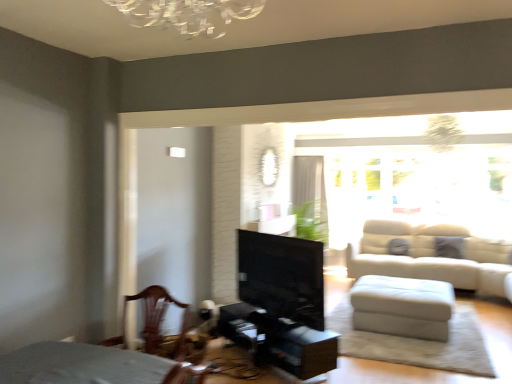
Question: Considering the relative sizes of transparent glass window at upper right and black glossy fireplace at center in the image provided, is transparent glass window at upper right taller than black glossy fireplace at center?

Choices:
 (A) no
 (B) yes

Answer: (B)

Question: Is transparent glass window at upper right not inside black glossy fireplace at center?

Choices:
 (A) yes
 (B) no

Answer: (A)

Question: Considering the relative positions of transparent glass window at upper right and black glossy fireplace at center in the image provided, is transparent glass window at upper right in front of black glossy fireplace at center?

Choices:
 (A) no
 (B) yes

Answer: (A)

Question: Does transparent glass window at upper right have a smaller size compared to black glossy fireplace at center?

Choices:
 (A) no
 (B) yes

Answer: (A)

Question: From a real-world perspective, does transparent glass window at upper right stand above black glossy fireplace at center?

Choices:
 (A) no
 (B) yes

Answer: (B)

Question: From the image's perspective, relative to white sheer curtain at upper center, is black glossy fireplace at center above or below?

Choices:
 (A) above
 (B) below

Answer: (B)

Question: Is black glossy fireplace at center inside the boundaries of white sheer curtain at upper center, or outside?

Choices:
 (A) outside
 (B) inside

Answer: (A)

Question: From a real-world perspective, is black glossy fireplace at center physically located above or below white sheer curtain at upper center?

Choices:
 (A) above
 (B) below

Answer: (B)

Question: Looking at the image, does black glossy fireplace at center seem bigger or smaller compared to white sheer curtain at upper center?

Choices:
 (A) big
 (B) small

Answer: (B)

Question: Considering the positions of black glossy fireplace at center and wooden chair at lower left in the image, is black glossy fireplace at center taller or shorter than wooden chair at lower left?

Choices:
 (A) short
 (B) tall

Answer: (B)

Question: Do you think black glossy fireplace at center is within wooden chair at lower left, or outside of it?

Choices:
 (A) inside
 (B) outside

Answer: (B)

Question: From the image's perspective, is black glossy fireplace at center located above or below wooden chair at lower left?

Choices:
 (A) below
 (B) above

Answer: (B)

Question: Does point (241, 263) appear closer or farther from the camera than point (98, 342)?

Choices:
 (A) closer
 (B) farther

Answer: (B)

Question: Based on their positions, is white sheer curtain at upper center located to the left or right of transparent glass window at upper right?

Choices:
 (A) left
 (B) right

Answer: (A)

Question: Considering the positions of white sheer curtain at upper center and transparent glass window at upper right in the image, is white sheer curtain at upper center bigger or smaller than transparent glass window at upper right?

Choices:
 (A) big
 (B) small

Answer: (B)